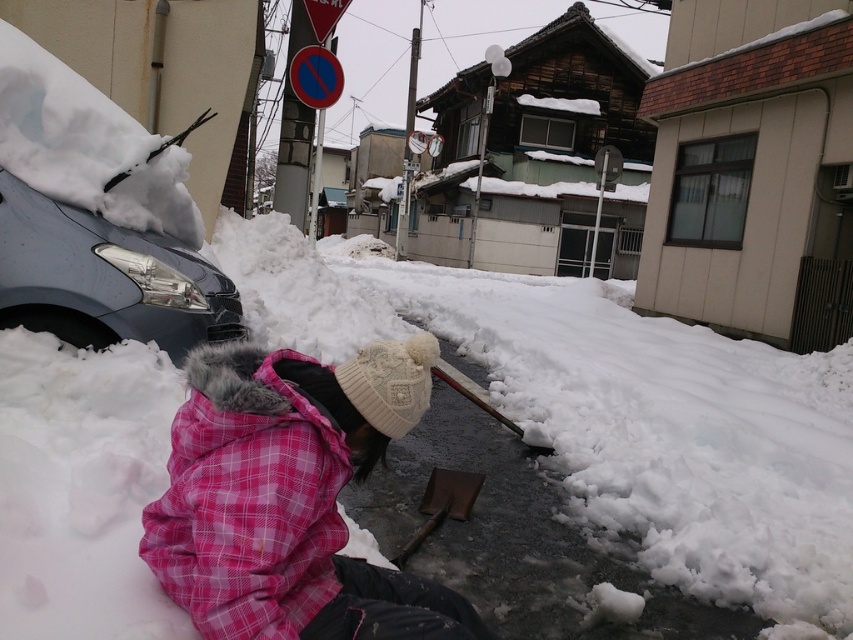
Question: Which object is farther from the camera taking this photo?

Choices:
 (A) white fluffy snow at center
 (B) wooden shovel at center
 (C) matte gray car at left

Answer: (C)

Question: Can you confirm if pink fleece jacket at lower left is smaller than wooden shovel at center?

Choices:
 (A) yes
 (B) no

Answer: (B)

Question: Estimate the real-world distances between objects in this image. Which object is farther from the pink fleece jacket at lower left?

Choices:
 (A) matte gray car at left
 (B) wooden shovel at center

Answer: (A)

Question: Does pink fleece jacket at lower left have a larger size compared to wooden shovel at center?

Choices:
 (A) no
 (B) yes

Answer: (B)

Question: Is white fluffy snow at center to the right of wooden shovel at center from the viewer's perspective?

Choices:
 (A) yes
 (B) no

Answer: (A)

Question: Which object is the closest to the white fluffy snow at center?

Choices:
 (A) pink fleece jacket at lower left
 (B) wooden shovel at center

Answer: (A)